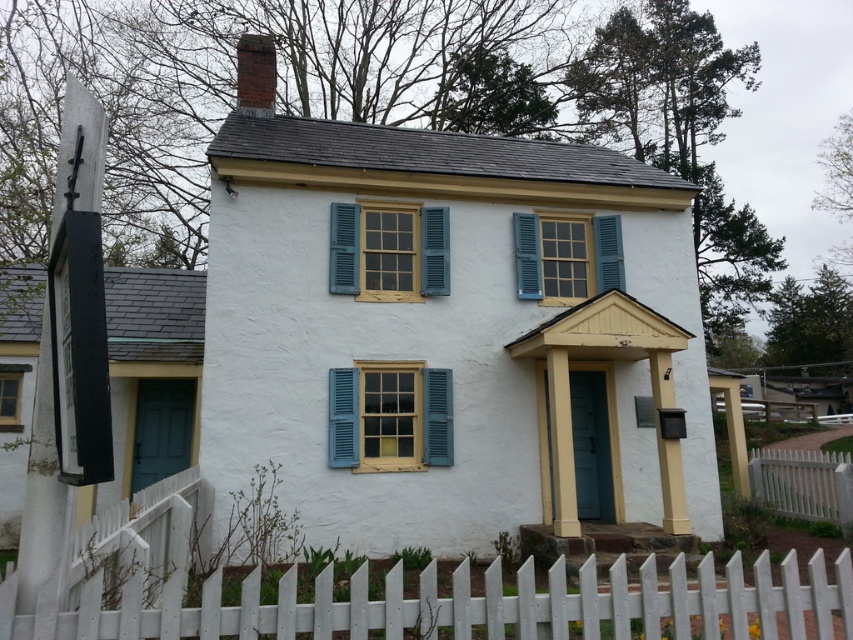
Is white picket fence at lower center taller than matte wooden window at left?

No.

Can you confirm if white picket fence at lower center is positioned to the left of matte wooden window at left?

In fact, white picket fence at lower center is to the right of matte wooden window at left.

You are a GUI agent. You are given a task and a screenshot of the screen. Output one action in this format:
    pyautogui.click(x=<x>, y=<y>)
    Task: Click on the white picket fence at lower center
    The width and height of the screenshot is (853, 640).
    Given the screenshot: What is the action you would take?
    pyautogui.click(x=465, y=604)

What are the coordinates of `white picket fence at lower center` in the screenshot? It's located at (465, 604).

Who is shorter, yellow wood window at center or white picket fence at lower right?

white picket fence at lower right is shorter.

Can you confirm if yellow wood window at center is bigger than white picket fence at lower right?

Incorrect, yellow wood window at center is not larger than white picket fence at lower right.

Does point (438, 230) come in front of point (828, 481)?

Yes.

I want to click on yellow wood window at center, so click(387, 250).

Which of these two, white picket fence at lower center or yellow wood window at center, stands shorter?

white picket fence at lower center

What are the coordinates of `white picket fence at lower center` in the screenshot? It's located at (465, 604).